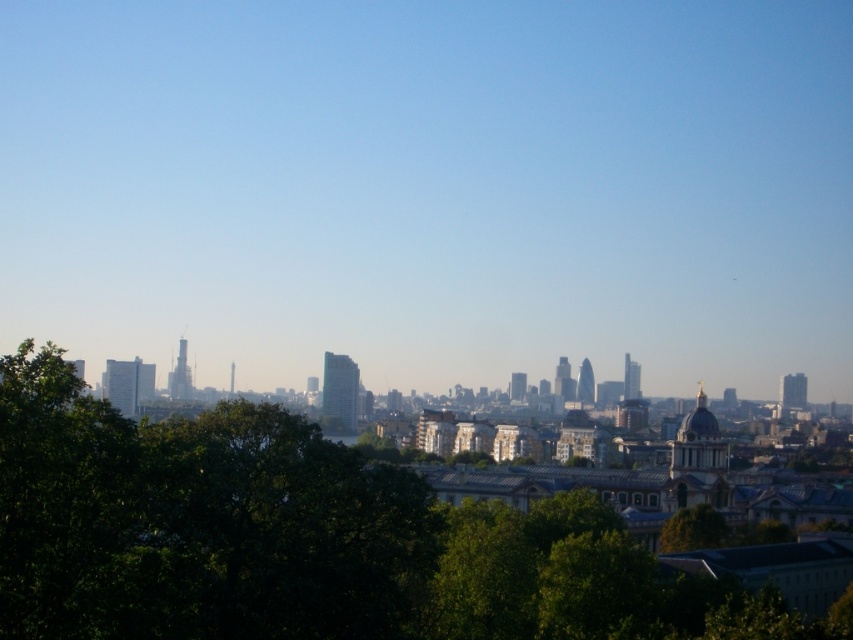
What do you see at coordinates (302, 538) in the screenshot?
I see `green leafy tree at lower left` at bounding box center [302, 538].

Does point (363, 589) come behind point (694, 515)?

Yes, it is.

Locate an element on the screen. Image resolution: width=853 pixels, height=640 pixels. green leafy tree at lower left is located at coordinates (302, 538).